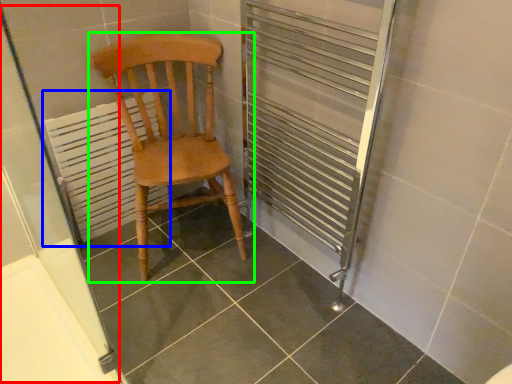
Question: Estimate the real-world distances between objects in this image. Which object is farther from screen door (highlighted by a red box), radiator (highlighted by a blue box) or chair (highlighted by a green box)?

Choices:
 (A) radiator
 (B) chair

Answer: (B)